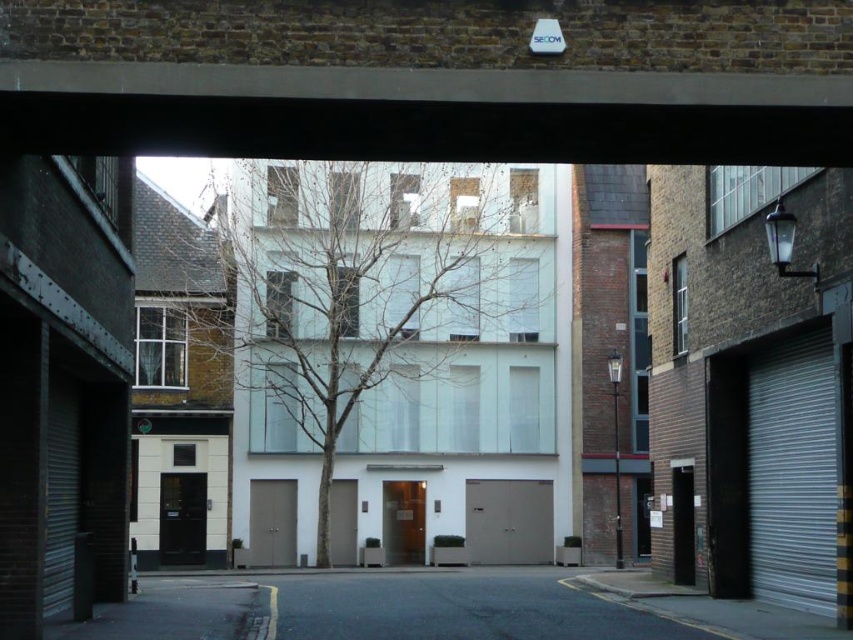
Question: Which point appears farthest from the camera in this image?

Choices:
 (A) (461, 148)
 (B) (469, 502)

Answer: (B)

Question: Which point is farther to the camera?

Choices:
 (A) metallic gray garage door at center
 (B) concrete at upper center

Answer: (A)

Question: Considering the relative positions of concrete at upper center and metallic gray garage door at center in the image provided, where is concrete at upper center located with respect to metallic gray garage door at center?

Choices:
 (A) left
 (B) right

Answer: (A)

Question: Does concrete at upper center appear on the left side of metallic gray garage door at center?

Choices:
 (A) yes
 (B) no

Answer: (A)

Question: Can you confirm if concrete at upper center is thinner than metallic gray garage door at center?

Choices:
 (A) yes
 (B) no

Answer: (B)

Question: Which of the following is the farthest from the observer?

Choices:
 (A) (547, 524)
 (B) (816, 154)

Answer: (A)